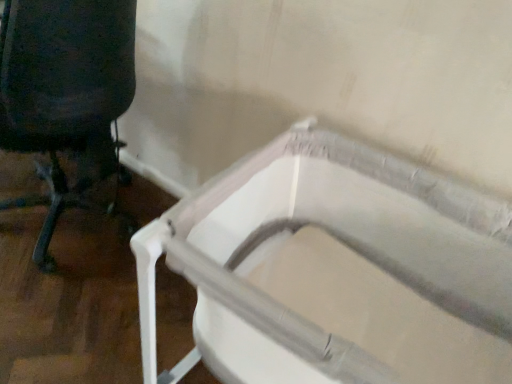
Question: Does white plastic bath at center have a larger size compared to black fabric chair at left?

Choices:
 (A) yes
 (B) no

Answer: (B)

Question: Considering the relative sizes of white plastic bath at center and black fabric chair at left in the image provided, is white plastic bath at center shorter than black fabric chair at left?

Choices:
 (A) yes
 (B) no

Answer: (A)

Question: Is white plastic bath at center placed right next to black fabric chair at left?

Choices:
 (A) no
 (B) yes

Answer: (A)

Question: From a real-world perspective, is white plastic bath at center physically above black fabric chair at left?

Choices:
 (A) yes
 (B) no

Answer: (B)

Question: Is white plastic bath at center not close to black fabric chair at left?

Choices:
 (A) no
 (B) yes

Answer: (A)

Question: From the image's perspective, would you say white plastic bath at center is shown under black fabric chair at left?

Choices:
 (A) yes
 (B) no

Answer: (A)

Question: Does black fabric chair at left lie in front of white plastic bath at center?

Choices:
 (A) yes
 (B) no

Answer: (B)

Question: From a real-world perspective, is black fabric chair at left positioned over white plastic bath at center based on gravity?

Choices:
 (A) yes
 (B) no

Answer: (A)

Question: Is the position of black fabric chair at left more distant than that of white plastic bath at center?

Choices:
 (A) no
 (B) yes

Answer: (B)

Question: Considering the relative sizes of black fabric chair at left and white plastic bath at center in the image provided, is black fabric chair at left bigger than white plastic bath at center?

Choices:
 (A) yes
 (B) no

Answer: (A)

Question: Are black fabric chair at left and white plastic bath at center beside each other?

Choices:
 (A) no
 (B) yes

Answer: (A)

Question: Considering the relative sizes of black fabric chair at left and white plastic bath at center in the image provided, is black fabric chair at left taller than white plastic bath at center?

Choices:
 (A) no
 (B) yes

Answer: (B)

Question: From a real-world perspective, is black fabric chair at left above or below white plastic bath at center?

Choices:
 (A) above
 (B) below

Answer: (A)